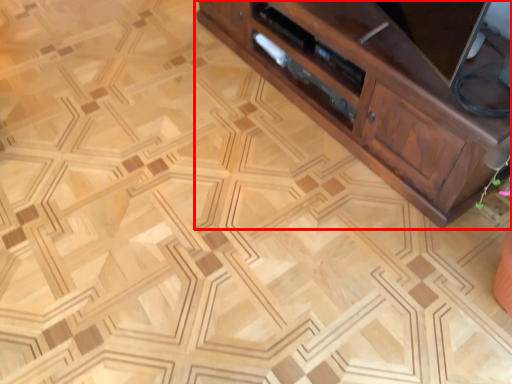
Question: Considering the relative positions of cabinetry (annotated by the red box) and drawer in the image provided, where is cabinetry (annotated by the red box) located with respect to the staircase?

Choices:
 (A) left
 (B) right

Answer: (B)